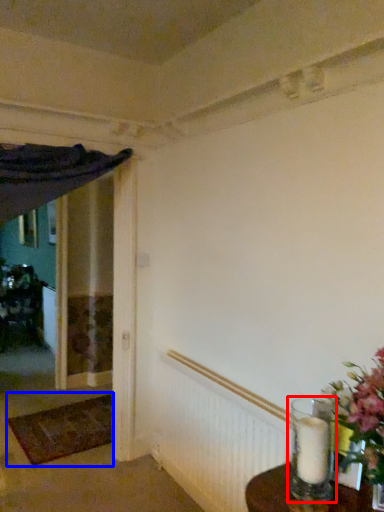
Question: Among these objects, which one is farthest to the camera, candle holder (highlighted by a red box) or doormat (highlighted by a blue box)?

Choices:
 (A) candle holder
 (B) doormat

Answer: (B)